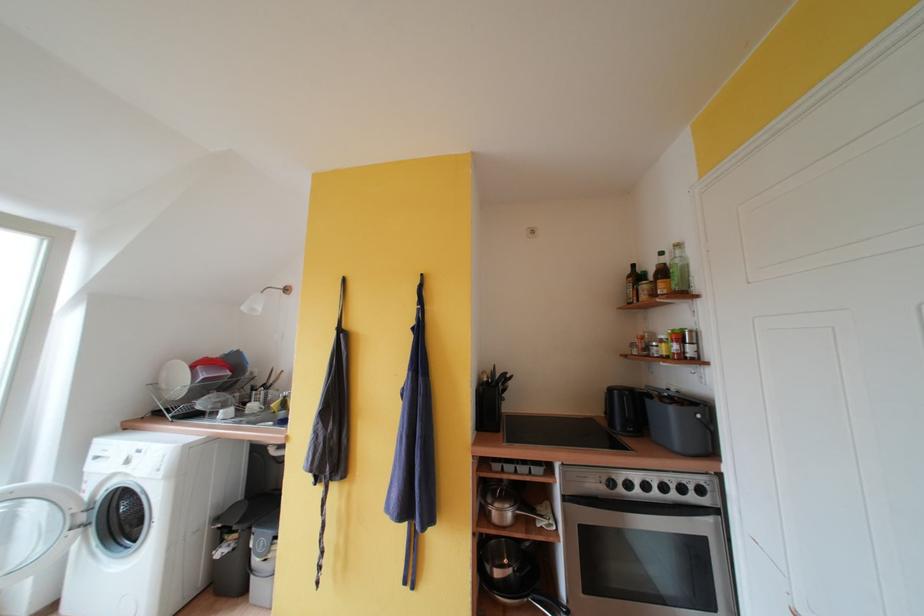
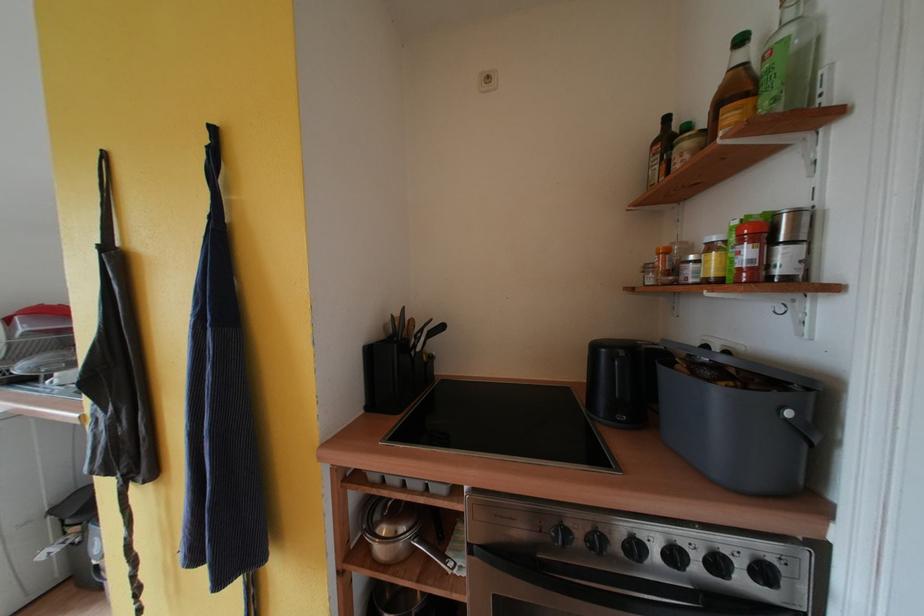
Locate, in the second image, the point that corresponds to the point at 495,504 in the first image.

(383, 521)